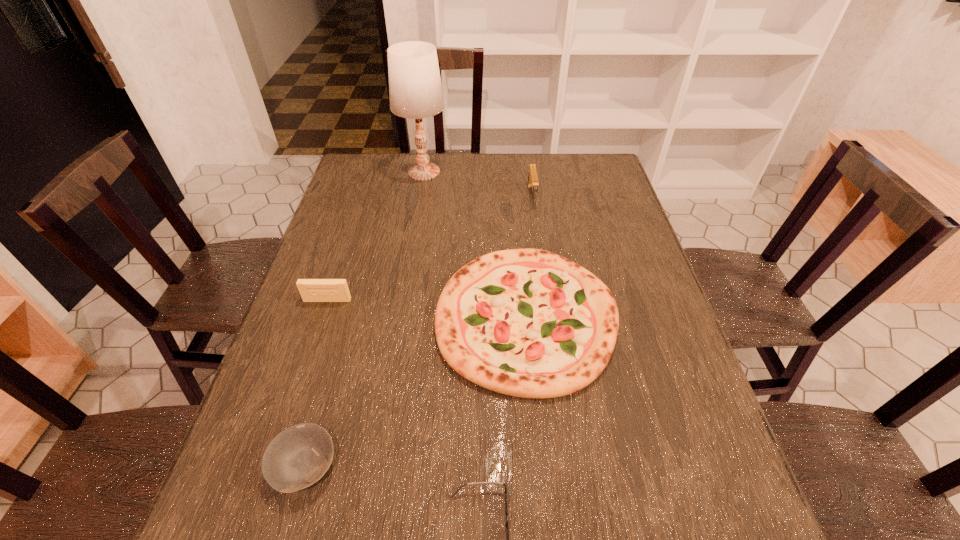
Locate an element on the screen. Image resolution: width=960 pixels, height=540 pixels. free spot between the second tallest object and the videotape is located at coordinates (429, 248).

The image size is (960, 540). Identify the location of free spot between the pizza and the lamp. (475, 244).

You are a GUI agent. You are given a task and a screenshot of the screen. Output one action in this format:
    pyautogui.click(x=<x>, y=<y>)
    Task: Click on the vacant space in between the pizza and the lamp
    This screenshot has height=540, width=960.
    Given the screenshot: What is the action you would take?
    pyautogui.click(x=475, y=244)

The image size is (960, 540). Find the location of `vacant point located between the tallest object and the bowl`. vacant point located between the tallest object and the bowl is located at coordinates (365, 319).

Image resolution: width=960 pixels, height=540 pixels. What are the coordinates of `free spot between the fourth shortest object and the pizza` in the screenshot? It's located at (427, 308).

Locate an element on the screen. The width and height of the screenshot is (960, 540). the fourth closest object relative to the videotape is located at coordinates (507, 525).

Point out which object is positioned as the fourth nearest to the bowl. Please provide its 2D coordinates. Your answer should be formatted as a tuple, i.e. [(x, y)], where the tuple contains the x and y coordinates of a point satisfying the conditions above.

[(532, 183)]

The image size is (960, 540). In order to click on vacant space that satisfies the following two spatial constraints: 1. at the front of the third tallest object with spools; 2. on the left side of the pizza in this screenshot , I will do point(322,317).

I want to click on vacant region that satisfies the following two spatial constraints: 1. at the front of the videotape with spools; 2. on the left side of the bowl, so click(x=273, y=466).

Where is `free location that satisfies the following two spatial constraints: 1. at the front of the videotape with spools; 2. on the right side of the pizza`? free location that satisfies the following two spatial constraints: 1. at the front of the videotape with spools; 2. on the right side of the pizza is located at coordinates (322, 317).